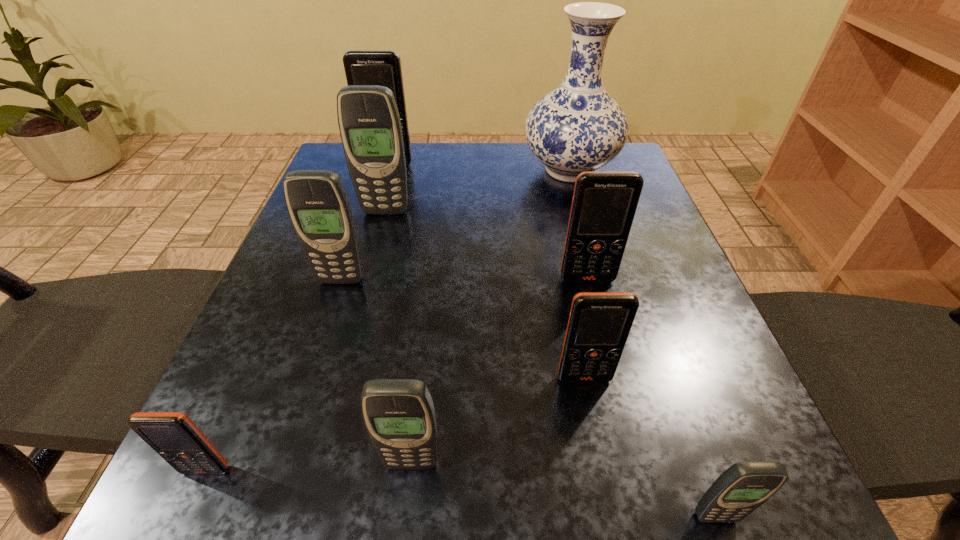
Where is `vacant space at the near edge`? vacant space at the near edge is located at coordinates click(479, 492).

Find the location of a particular element. free spot at the left edge of the desktop is located at coordinates (278, 272).

In the image, there is a desktop. Identify the location of vacant space at the right edge. This screenshot has height=540, width=960. (664, 274).

The height and width of the screenshot is (540, 960). In the image, there is a desktop. Identify the location of vacant space at the far left corner. (342, 145).

Identify the location of vacant area between the leftmost cellular telephone and the nearest object. (461, 493).

The height and width of the screenshot is (540, 960). In order to click on empty space that is in between the blue vase and the third smallest gray cellular telephone in this screenshot , I will do `click(455, 225)`.

The width and height of the screenshot is (960, 540). In order to click on vacant space in between the fifth cellular telephone from left to right and the farthest cellular telephone in this screenshot , I will do pos(400,314).

Locate an element on the screen. The width and height of the screenshot is (960, 540). free space between the leftmost cellular telephone and the farthest orange cellular telephone is located at coordinates (298, 317).

The width and height of the screenshot is (960, 540). In order to click on free spot between the second biggest gray cellular telephone and the second orange cellular telephone from left to right in this screenshot , I will do `click(365, 222)`.

Locate an element on the screen. This screenshot has width=960, height=540. empty space between the second biggest orange cellular telephone and the rightmost cellular telephone is located at coordinates (651, 398).